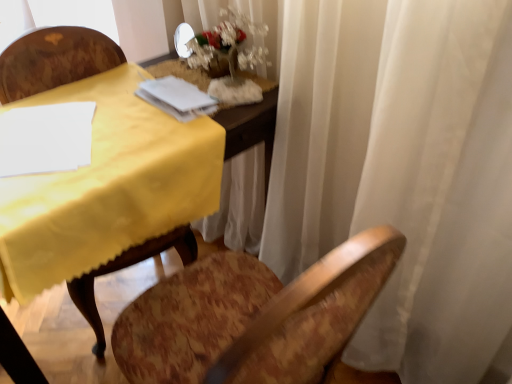
Question: Considering their positions, is white paper at upper center located in front of or behind white frosted glass vase at upper center?

Choices:
 (A) front
 (B) behind

Answer: (A)

Question: From a real-world perspective, is white paper at upper center positioned above or below white frosted glass vase at upper center?

Choices:
 (A) above
 (B) below

Answer: (B)

Question: Which is nearer to the wooden chair at left?

Choices:
 (A) white paper at upper center
 (B) white frosted glass vase at upper center

Answer: (A)

Question: Which of these objects is positioned farthest from the wooden chair at left?

Choices:
 (A) white paper at upper center
 (B) white frosted glass vase at upper center

Answer: (B)